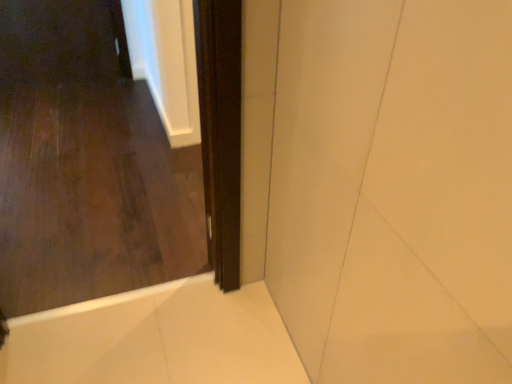
What is the approximate height of dark wood door at center?

1.20 meters.

Locate an element on the screen. Image resolution: width=512 pixels, height=384 pixels. dark wood door at center is located at coordinates (86, 164).

From the image's perspective, between dark wood door at center and dark wood screen door at center, which one is located above?

From the image's view, dark wood screen door at center is above.

Does dark wood door at center touch dark wood screen door at center?

No.

Is dark wood door at center inside or outside of dark wood screen door at center?

dark wood door at center is outside dark wood screen door at center.

From a real-world perspective, between white glossy bath at lower right and dark wood door at center, who is vertically higher?

dark wood door at center is physically above.

Measure the distance from white glossy bath at lower right to dark wood door at center.

white glossy bath at lower right and dark wood door at center are 18.12 inches apart from each other.

From the picture: Is white glossy bath at lower right directly adjacent to dark wood door at center?

No, white glossy bath at lower right is not next to dark wood door at center.

Is white glossy bath at lower right in front of or behind dark wood door at center in the image?

white glossy bath at lower right is positioned farther from the viewer than dark wood door at center.

Can you confirm if dark wood door at center is wider than white glossy bath at lower right?

In fact, dark wood door at center might be narrower than white glossy bath at lower right.

Is dark wood door at center further to the viewer compared to white glossy bath at lower right?

No, dark wood door at center is in front of white glossy bath at lower right.

From the image's perspective, is dark wood door at center over white glossy bath at lower right?

Yes, from the image's perspective, dark wood door at center is over white glossy bath at lower right.

This screenshot has width=512, height=384. I want to click on door above the white glossy bath at lower right (from a real-world perspective), so click(86, 164).

Between dark wood screen door at center and white glossy bath at lower right, which one has smaller size?

white glossy bath at lower right.

From the image's perspective, is dark wood screen door at center positioned above or below white glossy bath at lower right?

From the image's perspective, dark wood screen door at center appears above white glossy bath at lower right.

From the picture: Which object is positioned more to the right, dark wood screen door at center or white glossy bath at lower right?

dark wood screen door at center is more to the right.

Considering the relative positions of dark wood screen door at center and dark wood door at center in the image provided, is dark wood screen door at center in front of dark wood door at center?

That is False.

Based on the photo, is dark wood screen door at center turned away from dark wood door at center?

dark wood screen door at center does not have its back to dark wood door at center.

Which of these two, dark wood screen door at center or dark wood door at center, stands shorter?

With less height is dark wood screen door at center.

Based on the photo, between dark wood screen door at center and dark wood door at center, which one has larger size?

With larger size is dark wood door at center.

Is white glossy bath at lower right inside the boundaries of dark wood screen door at center, or outside?

white glossy bath at lower right is not inside dark wood screen door at center, it's outside.

Is white glossy bath at lower right bigger or smaller than dark wood screen door at center?

Clearly, white glossy bath at lower right is smaller in size than dark wood screen door at center.

Considering the relative sizes of white glossy bath at lower right and dark wood screen door at center in the image provided, is white glossy bath at lower right wider than dark wood screen door at center?

Yes.

The image size is (512, 384). I want to click on door below the dark wood screen door at center (from the image's perspective), so click(x=86, y=164).

Where is `door on the left of the white glossy bath at lower right`? door on the left of the white glossy bath at lower right is located at coordinates (86, 164).

Estimate the real-world distances between objects in this image. Which object is closer to dark wood screen door at center, dark wood door at center or white glossy bath at lower right?

white glossy bath at lower right is positioned closer to the anchor dark wood screen door at center.

Estimate the real-world distances between objects in this image. Which object is closer to dark wood door at center, white glossy bath at lower right or dark wood screen door at center?

white glossy bath at lower right lies closer to dark wood door at center than the other object.

When comparing their distances from dark wood door at center, does dark wood screen door at center or white glossy bath at lower right seem further?

Among the two, dark wood screen door at center is located further to dark wood door at center.

In the scene shown: Considering their positions, is dark wood screen door at center positioned closer to white glossy bath at lower right than dark wood door at center?

dark wood door at center lies closer to white glossy bath at lower right than the other object.

Considering their positions, is white glossy bath at lower right positioned closer to dark wood screen door at center than dark wood door at center?

white glossy bath at lower right lies closer to dark wood screen door at center than the other object.

From the image, which object appears to be nearer to white glossy bath at lower right, dark wood door at center or dark wood screen door at center?

dark wood door at center is positioned closer to the anchor white glossy bath at lower right.

At what (x,y) coordinates should I click in order to perform the action: click on door that lies between dark wood screen door at center and white glossy bath at lower right from top to bottom. Please return your answer as a coordinate pair (x, y). This screenshot has height=384, width=512. Looking at the image, I should click on 86,164.